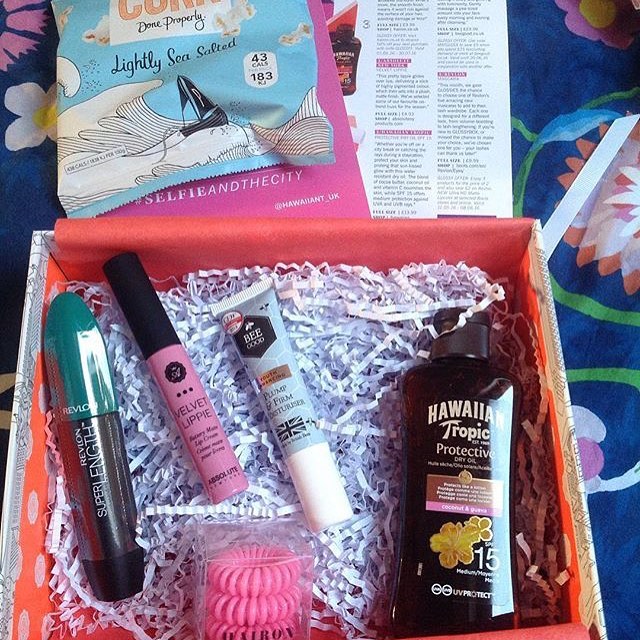
Image resolution: width=640 pixels, height=640 pixels. I want to click on blue and white makeup container, so click(273, 355).